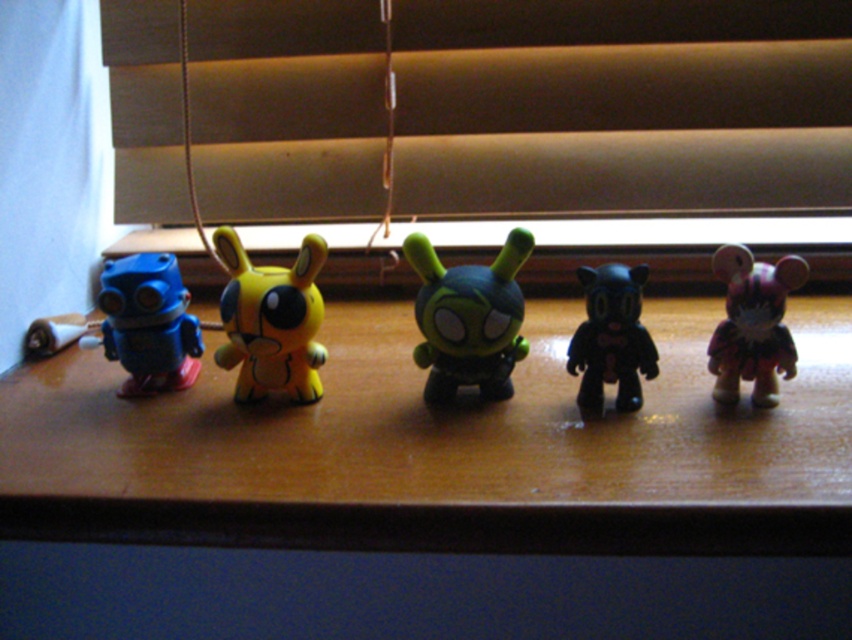
Question: Among these points, which one is farthest from the camera?

Choices:
 (A) (631, 547)
 (B) (272, 22)
 (C) (632, 404)
 (D) (108, 291)

Answer: (B)

Question: Does brown matte blinds at upper center have a smaller size compared to yellow matte pikachu at center?

Choices:
 (A) no
 (B) yes

Answer: (A)

Question: Which of the following is the closest to the observer?

Choices:
 (A) wooden table at center
 (B) brown matte blinds at upper center
 (C) matte blue robot at left

Answer: (A)

Question: Considering the real-world distances, which object is closest to the black matte bear at center?

Choices:
 (A) matte blue robot at left
 (B) wooden table at center
 (C) green matte toy at center

Answer: (C)

Question: Considering the relative positions of wooden shelf at center and yellow matte pikachu at center in the image provided, where is wooden shelf at center located with respect to yellow matte pikachu at center?

Choices:
 (A) left
 (B) right

Answer: (B)

Question: Where is green matte toy at center located in relation to shiny purple bear at right in the image?

Choices:
 (A) left
 (B) right

Answer: (A)